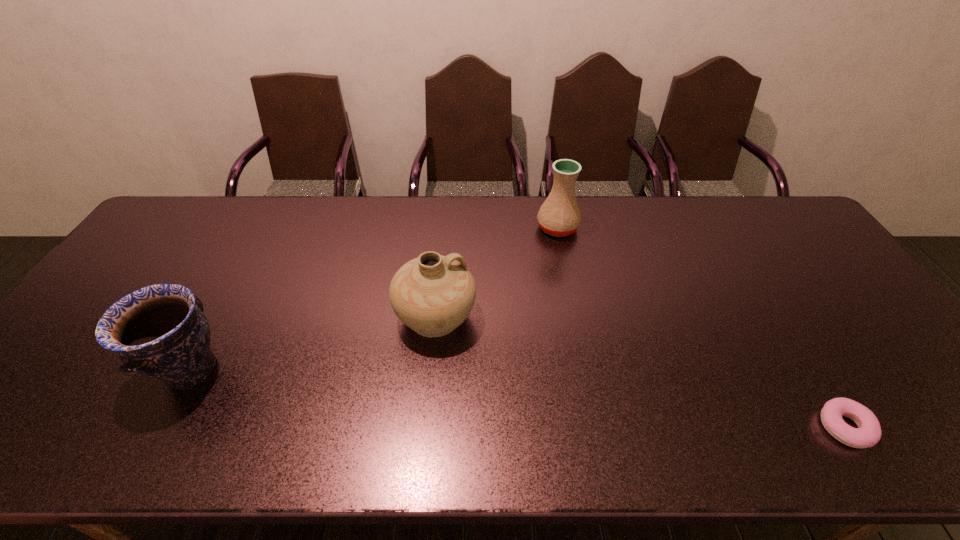
The image size is (960, 540). Find the location of `object at the far edge`. object at the far edge is located at coordinates (559, 215).

You are a GUI agent. You are given a task and a screenshot of the screen. Output one action in this format:
    pyautogui.click(x=<x>, y=<y>)
    Task: Click on the object present at the near edge
    The height and width of the screenshot is (540, 960).
    Given the screenshot: What is the action you would take?
    pyautogui.click(x=868, y=433)

This screenshot has height=540, width=960. Find the location of `free space at the far edge of the desktop`. free space at the far edge of the desktop is located at coordinates (243, 217).

Identify the location of free spot at the near edge of the desktop. (338, 433).

You are a GUI agent. You are given a task and a screenshot of the screen. Output one action in this format:
    pyautogui.click(x=<x>, y=<y>)
    Task: Click on the blank space at the left edge of the desktop
    The width and height of the screenshot is (960, 540).
    Given the screenshot: What is the action you would take?
    pyautogui.click(x=131, y=276)

Identify the location of vacant space at the right edge of the desktop. (935, 385).

Identify the location of free point at the far right corner. (765, 200).

You are a GUI agent. You are given a task and a screenshot of the screen. Output one action in this format:
    pyautogui.click(x=<x>, y=<y>)
    Task: Click on the vacant region at the near right corner of the desktop
    
    Given the screenshot: What is the action you would take?
    pyautogui.click(x=955, y=422)

Where is `unoccupied position between the leftmost pottery and the shortest object`? unoccupied position between the leftmost pottery and the shortest object is located at coordinates (517, 399).

The width and height of the screenshot is (960, 540). I want to click on unoccupied area between the rightmost object and the leftmost pottery, so click(517, 399).